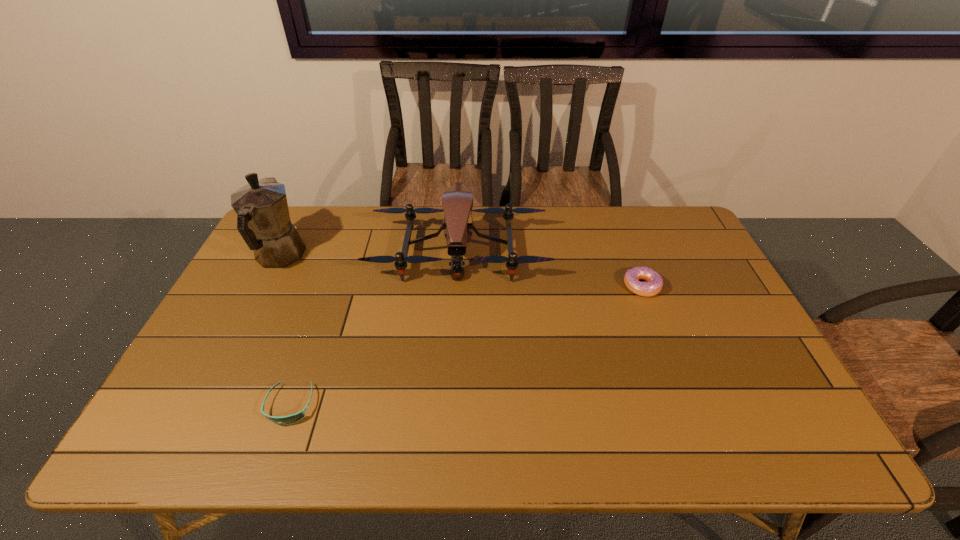
This screenshot has width=960, height=540. I want to click on free spot located 0.170m on the left of the doughnut, so click(x=567, y=286).

Where is `coffeepot located in the far edge section of the desktop`? coffeepot located in the far edge section of the desktop is located at coordinates (263, 220).

The width and height of the screenshot is (960, 540). What are the coordinates of `drone present at the far edge` in the screenshot? It's located at (457, 201).

Find the location of a particular element. This screenshot has width=960, height=540. object at the near edge is located at coordinates pyautogui.click(x=293, y=418).

I want to click on object located in the left edge section of the desktop, so click(x=263, y=220).

Where is `object located at the far left corner`? Image resolution: width=960 pixels, height=540 pixels. object located at the far left corner is located at coordinates (263, 220).

Image resolution: width=960 pixels, height=540 pixels. I want to click on free space at the far edge of the desktop, so click(x=564, y=207).

This screenshot has width=960, height=540. In order to click on free region at the left edge in this screenshot , I will do (x=214, y=380).

The width and height of the screenshot is (960, 540). I want to click on free space at the right edge of the desktop, so click(x=710, y=350).

This screenshot has width=960, height=540. I want to click on vacant space at the far right corner of the desktop, so click(x=673, y=225).